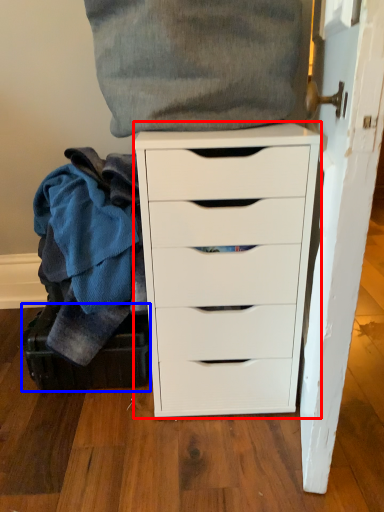
Question: Which of the following is the farthest to the observer, chest of drawers (highlighted by a red box) or luggage (highlighted by a blue box)?

Choices:
 (A) chest of drawers
 (B) luggage

Answer: (B)